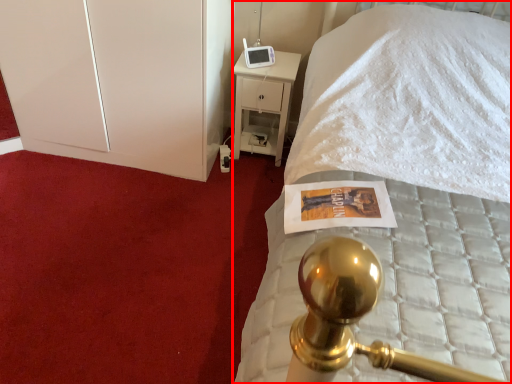
Question: From the image's perspective, what is the correct spatial positioning of bed (annotated by the red box) in reference to dresser?

Choices:
 (A) below
 (B) above

Answer: (A)